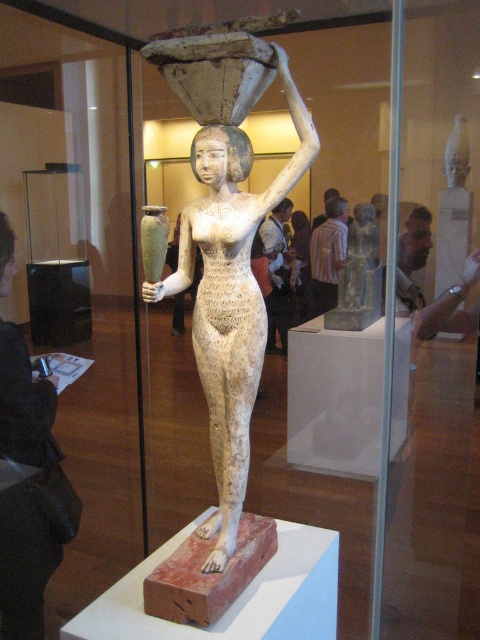
You are a museum visitor standing 5 feet away from the entrance. The white stone statue at center is your main attraction. Can you reach the statue without moving closer than your current position?

The white stone statue at center is 4.43 feet away from the camera, so if you are currently 5 feet away from the entrance, you might not be able to reach it without moving closer, as the statue is closer to you than the entrance distance. However, exact accessibility depends on the layout between you and the statue.

You are a security guard in the museum and need to check if the black leather jacket at lower left is within the 3 meters safety zone around the gray stone statue at center. Is it within the zone?

The black leather jacket at lower left is 2.74 meters from the gray stone statue at center, which is within the 3 meters safety zone.

You are standing in front of the ancient Egyptian statue and want to locate two points marked on the pedestal. The first point is at coordinates point [12,577] and the second is at point [456,157]. Which point is closer to you?

Point [12,577] is in front of point [456,157], so the first point is closer to you.